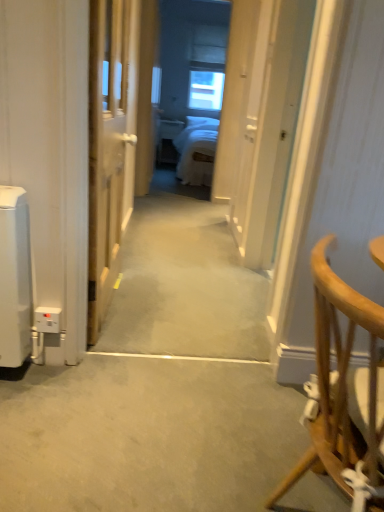
This screenshot has height=512, width=384. Find the location of `free point below wooden door at center (from a real-world perspective)`. free point below wooden door at center (from a real-world perspective) is located at coordinates (110, 315).